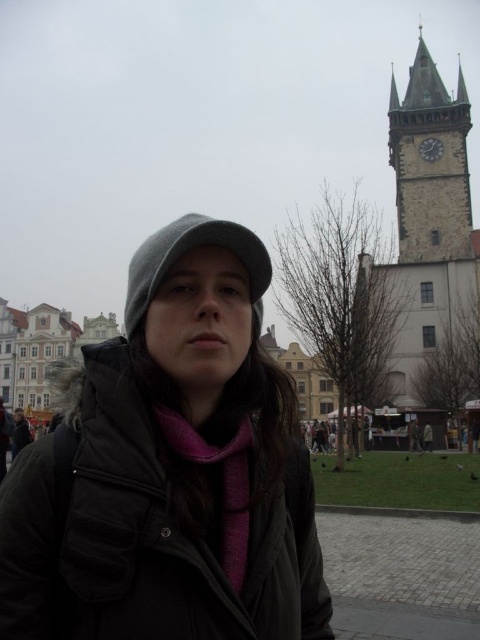
Between matte gray beanie at center and stone clock tower at upper right, which one is positioned lower?

matte gray beanie at center is below.

Does matte gray beanie at center appear under stone clock tower at upper right?

Indeed, matte gray beanie at center is positioned under stone clock tower at upper right.

Does point (241, 536) come farther from viewer compared to point (397, 198)?

That is False.

The image size is (480, 640). Identify the location of matte gray beanie at center. (170, 468).

Between matte gray beanie at center and gray woolen hat at center, which one is positioned higher?

gray woolen hat at center

Is point (20, 500) less distant than point (260, 259)?

That is True.

Locate an element on the screen. The height and width of the screenshot is (640, 480). matte gray beanie at center is located at coordinates (170, 468).

Locate an element on the screen. The image size is (480, 640). matte gray beanie at center is located at coordinates (170, 468).

Who is more distant from viewer, (x=414, y=145) or (x=240, y=579)?

The point (x=414, y=145) is behind.

Is stone clock tower at upper right above purple soft scarf at center?

Yes, stone clock tower at upper right is above purple soft scarf at center.

Is point (404, 230) farther from camera compared to point (175, 449)?

Yes, it is behind point (175, 449).

You are a GUI agent. You are given a task and a screenshot of the screen. Output one action in this format:
    pyautogui.click(x=<x>, y=<y>)
    Task: Click on the stone clock tower at upper right
    The width and height of the screenshot is (480, 640).
    Given the screenshot: What is the action you would take?
    pyautogui.click(x=430, y=163)